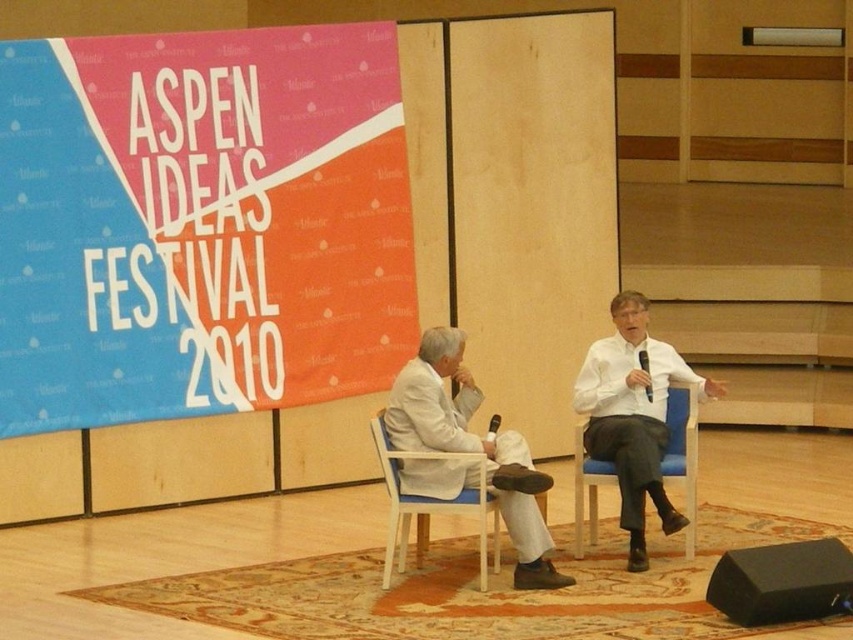
Question: Is white fabric suit at center thinner than white plastic chair at center?

Choices:
 (A) yes
 (B) no

Answer: (B)

Question: Which point is closer to the camera taking this photo?

Choices:
 (A) (816, 570)
 (B) (381, 440)
 (C) (691, 481)

Answer: (A)

Question: Among these objects, which one is nearest to the camera?

Choices:
 (A) white fabric suit at center
 (B) blue fabric chair at right
 (C) black matte speaker at lower right
 (D) white plastic chair at center

Answer: (C)

Question: Which of these objects is positioned closest to the blue fabric chair at right?

Choices:
 (A) white fabric suit at center
 (B) black matte speaker at lower right

Answer: (A)

Question: Considering the relative positions of white plastic chair at center and blue fabric chair at right in the image provided, where is white plastic chair at center located with respect to blue fabric chair at right?

Choices:
 (A) below
 (B) above

Answer: (A)

Question: Can you confirm if white plastic chair at center is positioned to the left of blue fabric chair at right?

Choices:
 (A) no
 (B) yes

Answer: (B)